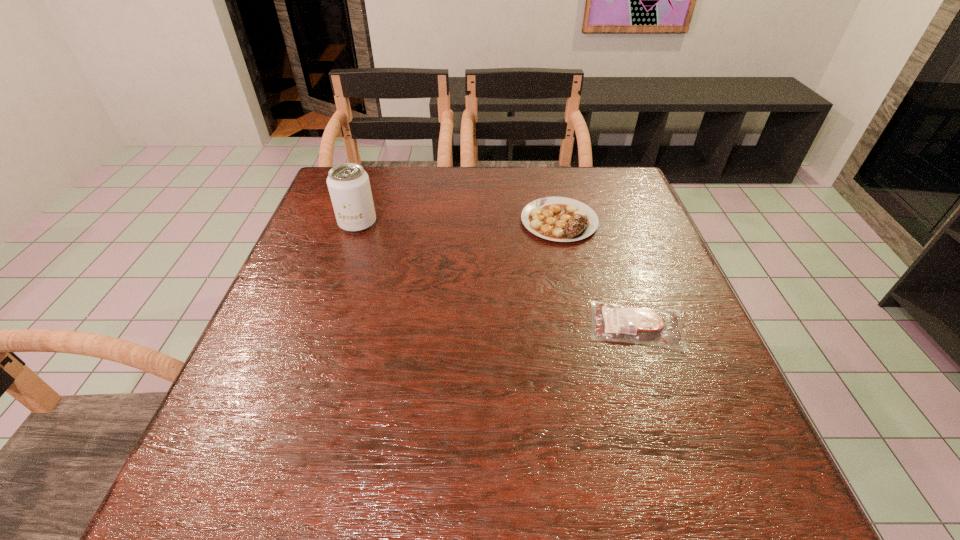
Identify the location of soda can. (348, 183).

Image resolution: width=960 pixels, height=540 pixels. Identify the location of the leftmost object. (348, 183).

You are a GUI agent. You are given a task and a screenshot of the screen. Output one action in this format:
    pyautogui.click(x=<x>, y=<y>)
    Task: Click on the taller steak
    This screenshot has height=540, width=960.
    Given the screenshot: What is the action you would take?
    pyautogui.click(x=561, y=219)

Identify the location of the second tallest object. (561, 219).

Where is `the shorter steak`? This screenshot has width=960, height=540. the shorter steak is located at coordinates (640, 325).

At what (x,y) coordinates should I click in order to perform the action: click on the shortest object. Please return your answer as a coordinate pair (x, y). The height and width of the screenshot is (540, 960). Looking at the image, I should click on (640, 325).

Identify the location of vacant space located on the back of the tallest object. The image size is (960, 540). (374, 173).

Find the location of a particular element. Image resolution: width=960 pixels, height=540 pixels. vacant space located 0.240m on the left of the farther steak is located at coordinates (431, 221).

Locate an element on the screen. free space located on the left of the shorter steak is located at coordinates (442, 326).

At what (x,y) coordinates should I click in order to perform the action: click on object located at the far edge. Please return your answer as a coordinate pair (x, y). The width and height of the screenshot is (960, 540). Looking at the image, I should click on (561, 219).